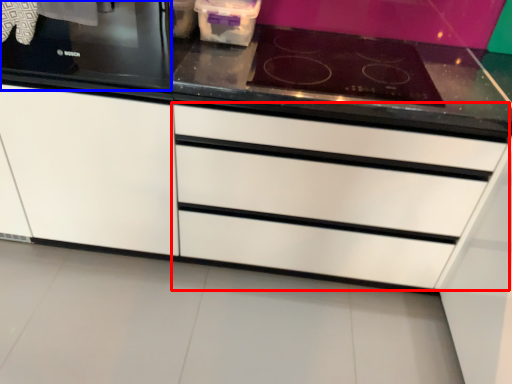
Question: Which of the following is the closest to the observer, drawer (highlighted by a red box) or home appliance (highlighted by a blue box)?

Choices:
 (A) drawer
 (B) home appliance

Answer: (B)